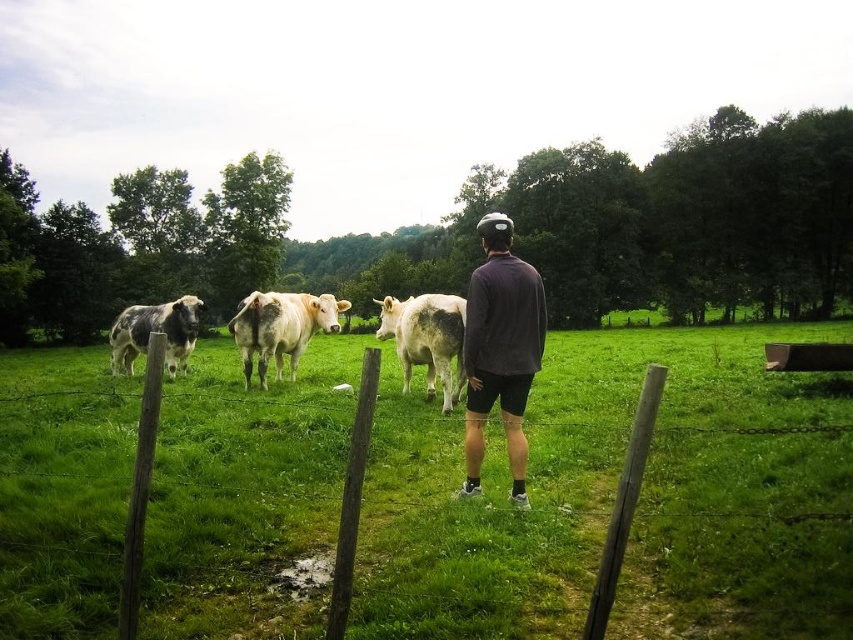
The image size is (853, 640). What do you see at coordinates (613, 497) in the screenshot?
I see `green grassy field at center` at bounding box center [613, 497].

Who is more forward, (36, 557) or (306, 310)?

Point (36, 557) is more forward.

Who is more distant from viewer, (660, 497) or (262, 360)?

Positioned behind is point (262, 360).

Identify the location of green grassy field at center. Image resolution: width=853 pixels, height=640 pixels. (613, 497).

Who is taller, green grassy field at center or white matte cow at center?

Standing taller between the two is white matte cow at center.

Between point (541, 508) and point (389, 316), which one is positioned in front?

Positioned in front is point (541, 508).

The width and height of the screenshot is (853, 640). Describe the element at coordinates (613, 497) in the screenshot. I see `green grassy field at center` at that location.

Locate an element on the screen. green grassy field at center is located at coordinates (613, 497).

Can you confirm if dark gray jersey at center is bigger than speckled fur bull at left?

No, dark gray jersey at center is not bigger than speckled fur bull at left.

Is point (463, 484) positioned before point (175, 312)?

That is True.

I want to click on dark gray jersey at center, so click(500, 349).

The height and width of the screenshot is (640, 853). Identify the location of dark gray jersey at center. (500, 349).